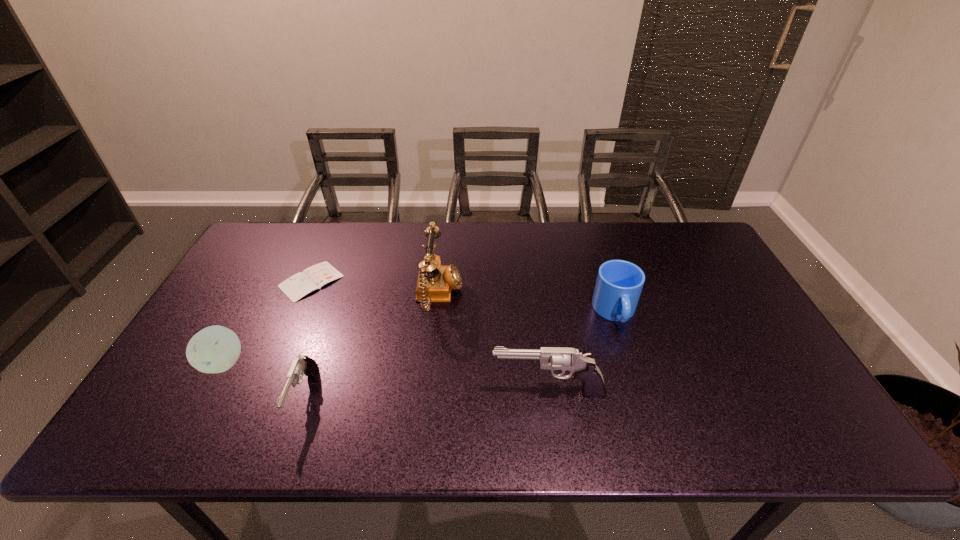
The image size is (960, 540). What are the coordinates of `the left gun` in the screenshot? It's located at (303, 364).

Where is `the second tallest object`? This screenshot has height=540, width=960. the second tallest object is located at coordinates (583, 367).

Find the location of a particular element. the taller gun is located at coordinates (583, 367).

The width and height of the screenshot is (960, 540). What are the coordinates of `diary` in the screenshot? It's located at (297, 286).

Image resolution: width=960 pixels, height=540 pixels. I want to click on the tallest object, so click(434, 284).

Identify the location of the fourth object from left to right. The height and width of the screenshot is (540, 960). (434, 284).

The width and height of the screenshot is (960, 540). Find the location of `the rightmost object`. the rightmost object is located at coordinates (619, 283).

The height and width of the screenshot is (540, 960). What are the coordinates of `apple` in the screenshot? It's located at (215, 349).

The width and height of the screenshot is (960, 540). Identify the location of vacant space located 0.220m at the muzzle of the second tallest object. (399, 392).

At what (x,y) coordinates should I click in order to perform the action: click on vacant space located at the muzzle of the second tallest object. Please return your answer as a coordinate pair (x, y). This screenshot has height=540, width=960. Looking at the image, I should click on (396, 392).